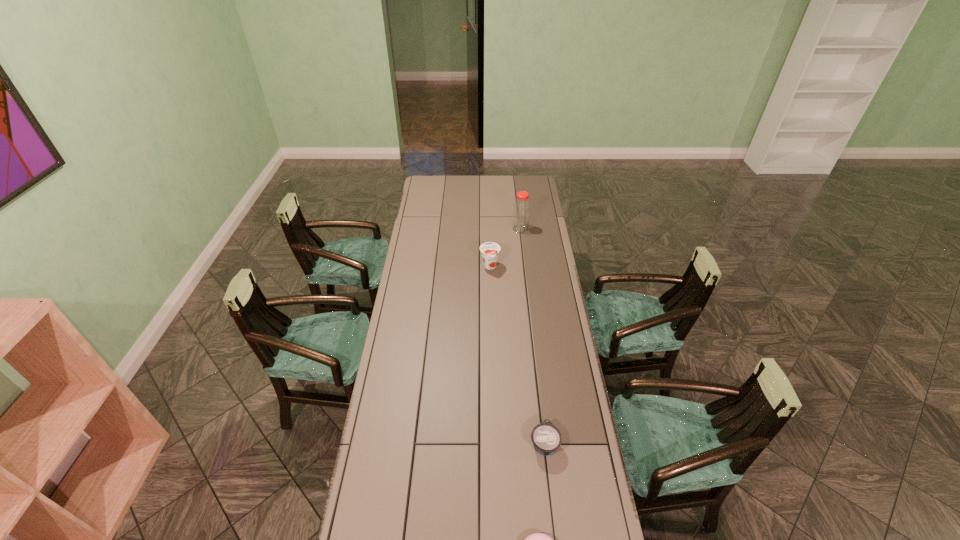
Locate an element on the screen. yogurt located in the right edge section of the desktop is located at coordinates (546, 438).

In the image, there is a desktop. At what (x,y) coordinates should I click in order to perform the action: click on free space at the far edge. Please return your answer as a coordinate pair (x, y). Image resolution: width=960 pixels, height=540 pixels. Looking at the image, I should click on (468, 192).

You are a GUI agent. You are given a task and a screenshot of the screen. Output one action in this format:
    pyautogui.click(x=<x>, y=<y>)
    Task: Click on the vacant space at the left edge of the desktop
    The image size is (960, 540).
    Given the screenshot: What is the action you would take?
    pyautogui.click(x=419, y=282)

I want to click on vacant space at the right edge of the desktop, so click(550, 375).

This screenshot has width=960, height=540. What are the coordinates of `vacant region at the far left corner of the desktop` in the screenshot? It's located at (444, 194).

In the image, there is a desktop. Where is `vacant space at the far right corner`? This screenshot has height=540, width=960. vacant space at the far right corner is located at coordinates (516, 181).

Identify the location of vacant area that lies between the taller yogurt and the shorter yogurt. The image size is (960, 540). tap(517, 355).

The height and width of the screenshot is (540, 960). In order to click on vacant area that lies between the farthest object and the second farthest object in this screenshot , I will do `click(505, 247)`.

Identify the location of free space that is in between the taller yogurt and the nearer yogurt. The width and height of the screenshot is (960, 540). (517, 355).

This screenshot has width=960, height=540. Identify the location of vacant space that is in between the farther yogurt and the farthest object. (505, 247).